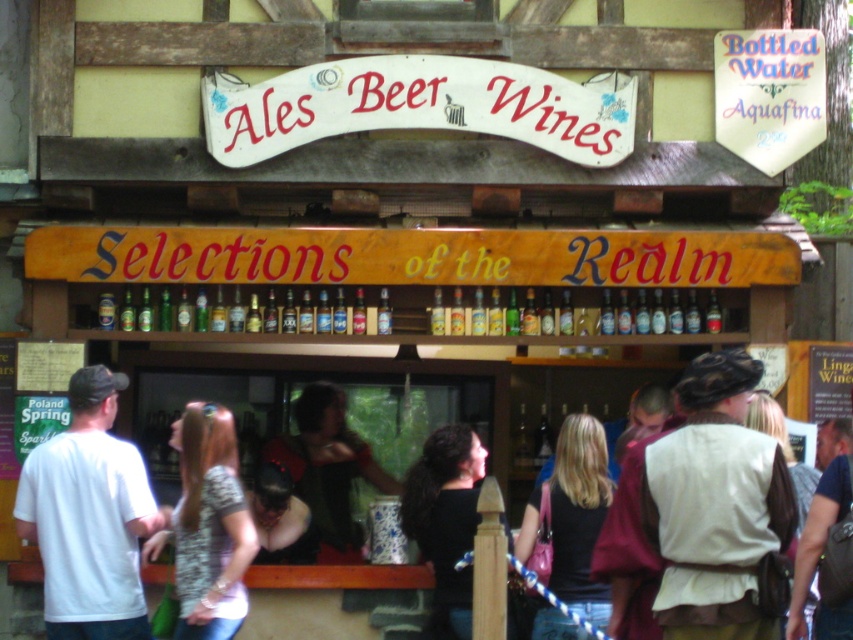
In the scene shown: Does patterned fabric shirt at lower left have a greater height compared to dark green leather vest at center?

Indeed, patterned fabric shirt at lower left has a greater height compared to dark green leather vest at center.

Based on the photo, who is shorter, patterned fabric shirt at lower left or dark green leather vest at center?

Standing shorter between the two is dark green leather vest at center.

What do you see at coordinates (207, 525) in the screenshot?
I see `patterned fabric shirt at lower left` at bounding box center [207, 525].

Image resolution: width=853 pixels, height=640 pixels. I want to click on patterned fabric shirt at lower left, so click(207, 525).

Between patterned fabric shirt at lower left and black leather jacket at lower center, which one is positioned lower?

Positioned lower is black leather jacket at lower center.

Is patterned fabric shirt at lower left thinner than black leather jacket at lower center?

No.

Identify the location of patterned fabric shirt at lower left. (207, 525).

Does white fabric vest at center appear over patterned fabric shirt at lower left?

Correct, white fabric vest at center is located above patterned fabric shirt at lower left.

Does point (714, 500) come in front of point (247, 502)?

Yes, point (714, 500) is in front of point (247, 502).

Where is `white fabric vest at center`? The height and width of the screenshot is (640, 853). white fabric vest at center is located at coordinates (715, 504).

The width and height of the screenshot is (853, 640). Find the location of `white fabric vest at center`. white fabric vest at center is located at coordinates [715, 504].